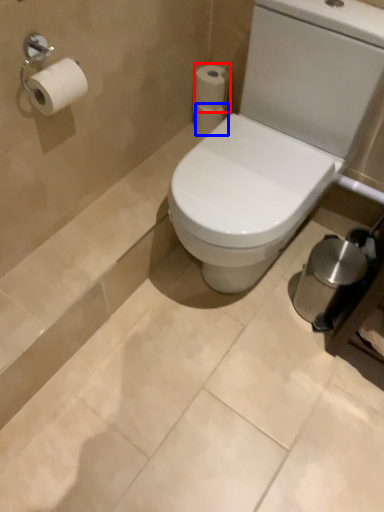
Question: Which of the following is the closest to the observer, toilet paper (highlighted by a red box) or toilet paper (highlighted by a blue box)?

Choices:
 (A) toilet paper
 (B) toilet paper

Answer: (A)